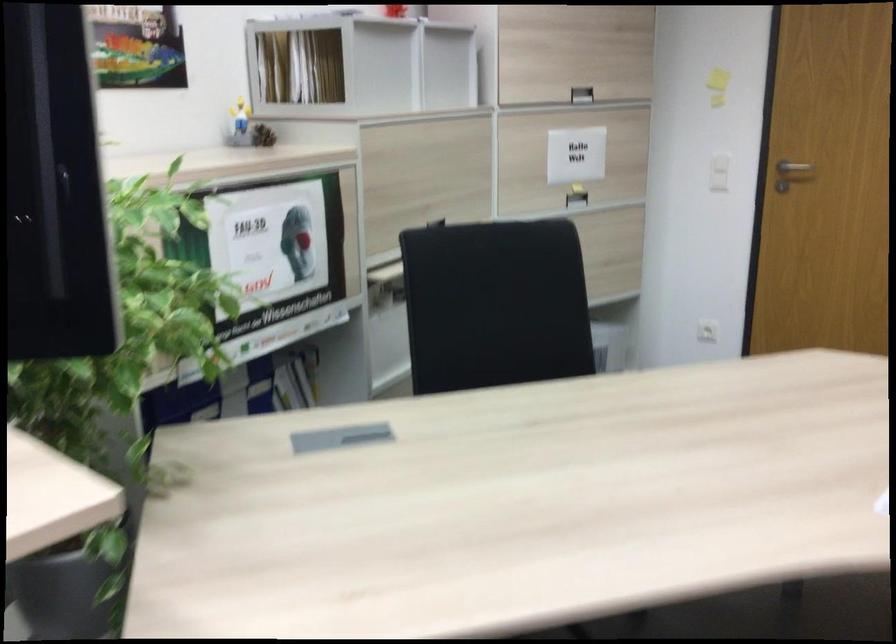
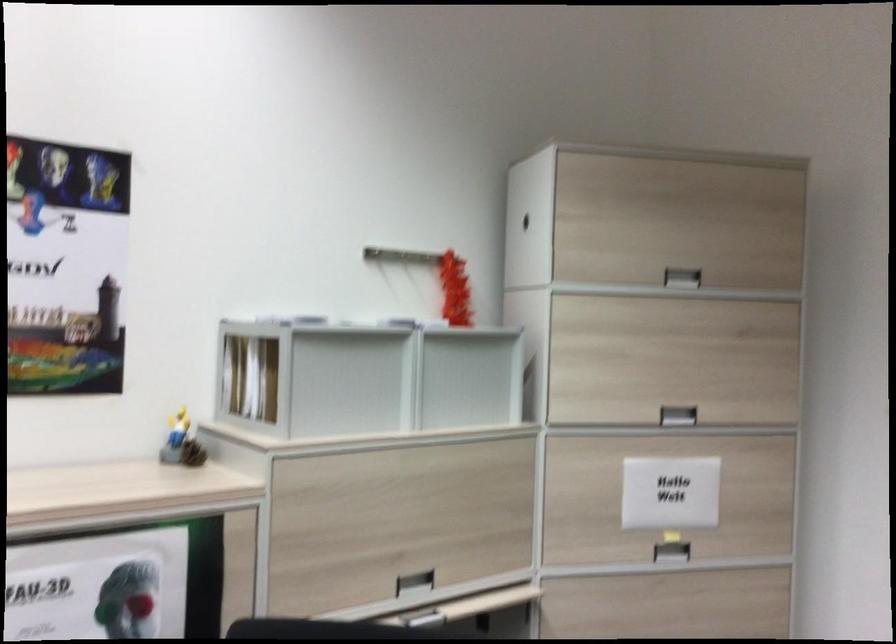
Locate, in the second image, the point that corresponds to pixel 578 198 in the first image.

(670, 552)